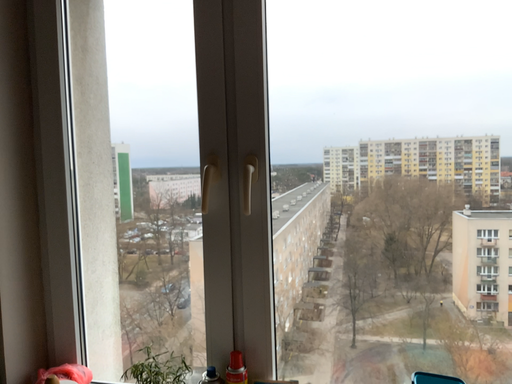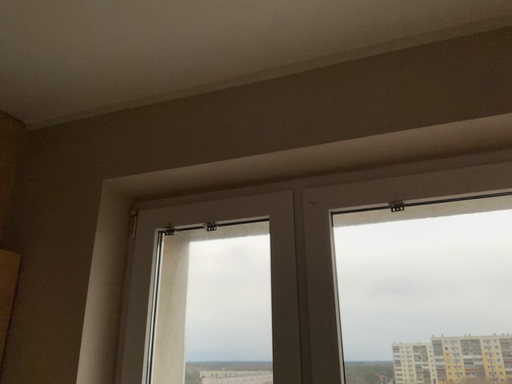
Question: How did the camera likely rotate when shooting the video?

Choices:
 (A) rotated downward
 (B) rotated upward

Answer: (B)